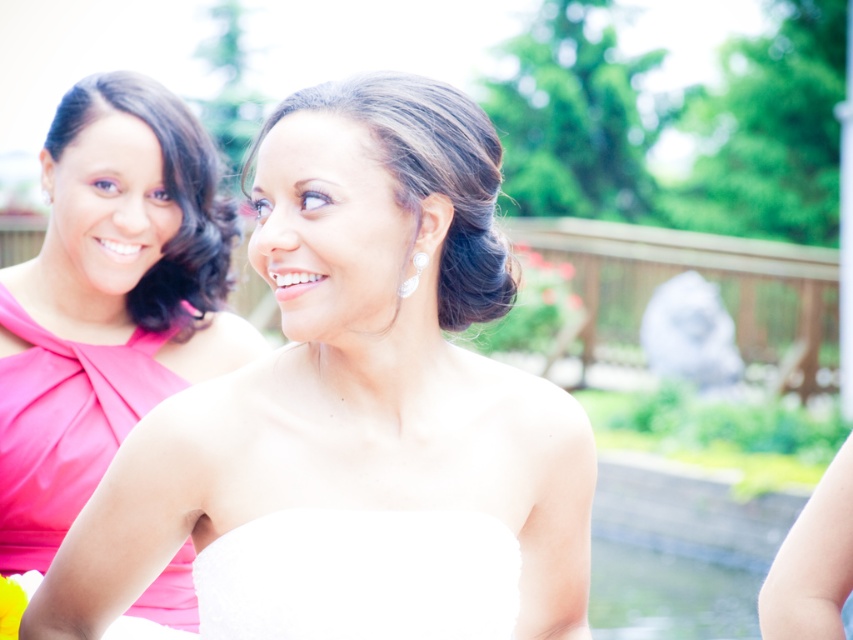
Does white satin dress at center have a greater height compared to matte pink dress at left?

Incorrect, white satin dress at center's height is not larger of matte pink dress at left's.

Is white satin dress at center to the left of matte pink dress at left from the viewer's perspective?

Incorrect, white satin dress at center is not on the left side of matte pink dress at left.

Is point (376, 156) positioned after point (184, 330)?

No, (376, 156) is closer to viewer.

Find the location of a particular element. white satin dress at center is located at coordinates (352, 371).

Between point (177, 129) and point (416, 278), which one is positioned behind?

Positioned behind is point (177, 129).

What do you see at coordinates (108, 300) in the screenshot? The image size is (853, 640). I see `matte pink dress at left` at bounding box center [108, 300].

At what (x,y) coordinates should I click in order to perform the action: click on matte pink dress at left. Please return your answer as a coordinate pair (x, y). The width and height of the screenshot is (853, 640). Looking at the image, I should click on (108, 300).

Is white satin dress at center smaller than pearl shiny earring at upper center?

No.

Can you confirm if white satin dress at center is positioned to the left of pearl shiny earring at upper center?

Correct, you'll find white satin dress at center to the left of pearl shiny earring at upper center.

Between point (453, 400) and point (416, 273), which one is positioned in front?

Positioned in front is point (416, 273).

Locate an element on the screen. white satin dress at center is located at coordinates (352, 371).